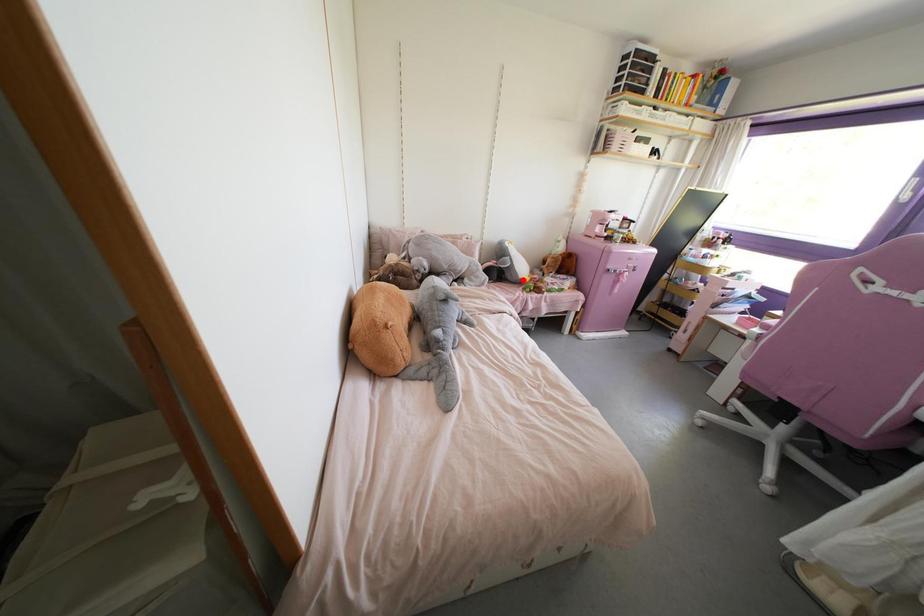
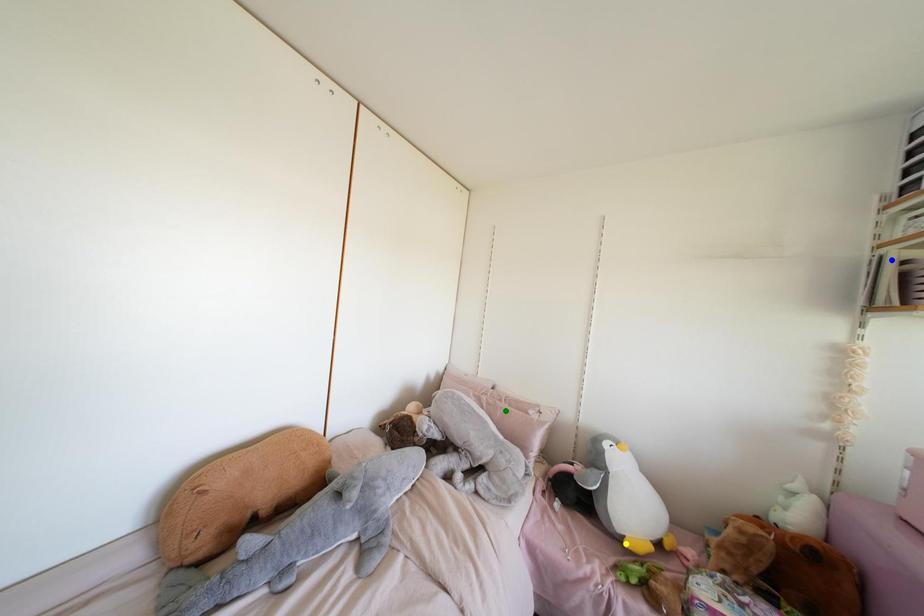
Question: I am providing you with two images of the same scene from different viewpoints. A red point is marked on the first image. You are given multiple points on the second image. Which mark in image 2 goes with the point in image 1?

Choices:
 (A) blue point
 (B) yellow point
 (C) green point

Answer: (B)